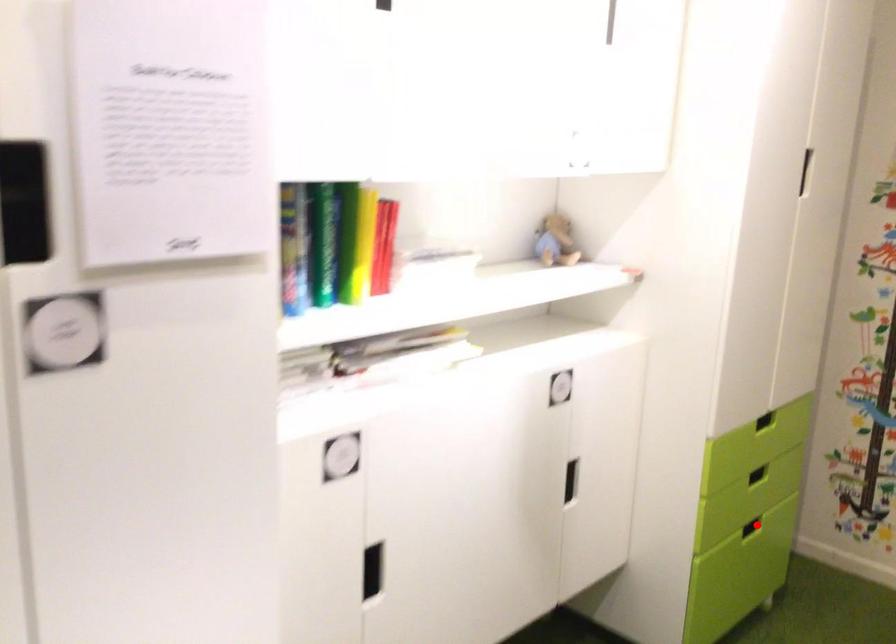
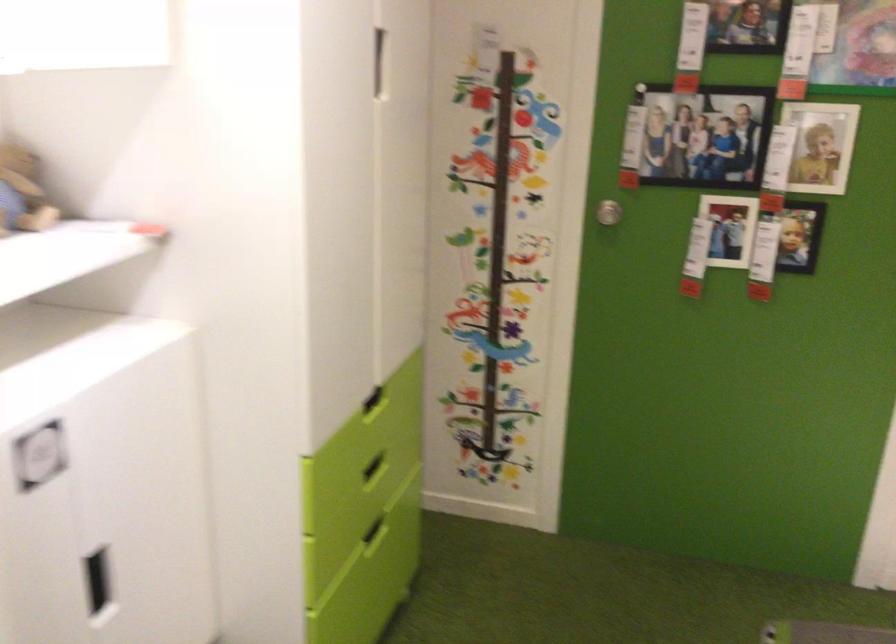
Find the pixel in the second image that matches the highlighted location in the first image.

(375, 531)